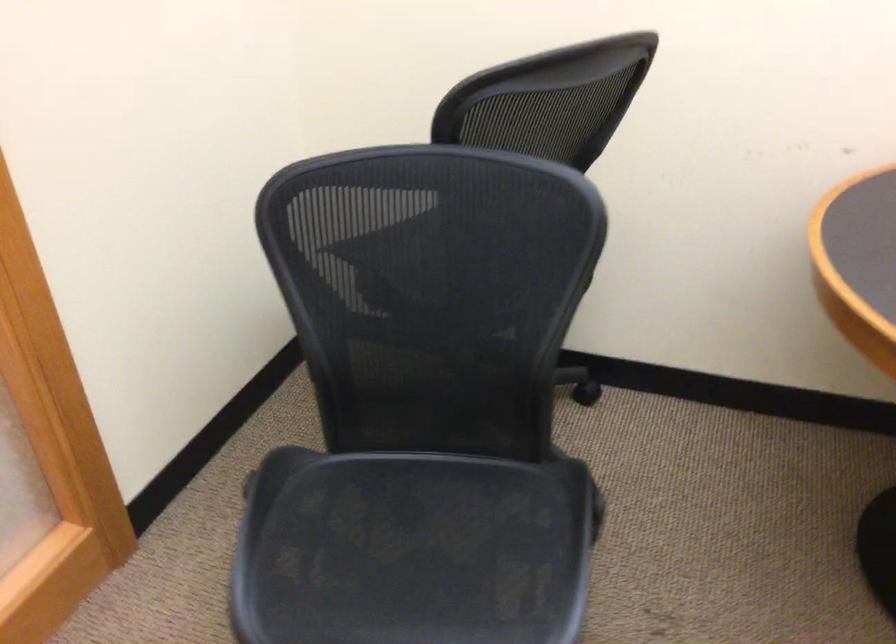
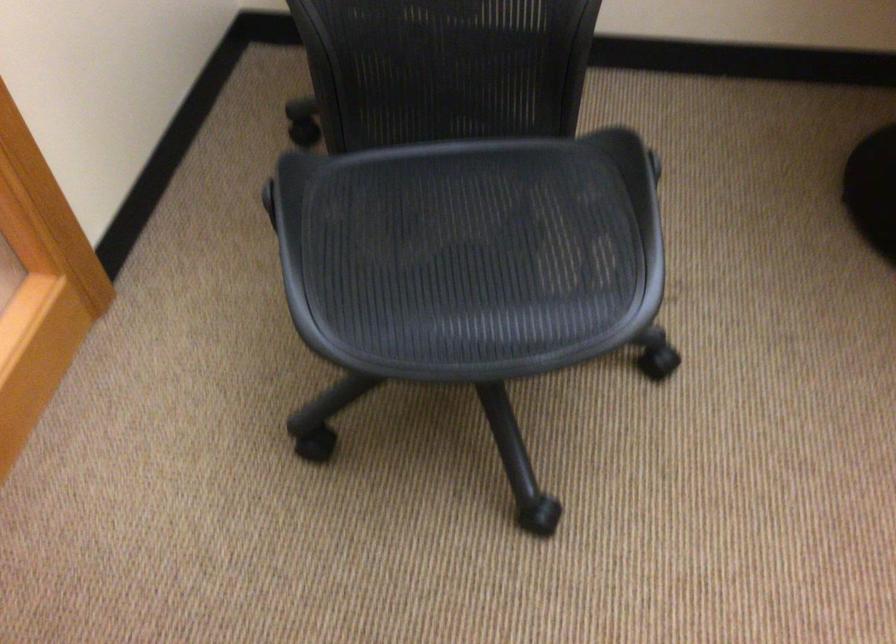
Find the pixel in the second image that matches pixel 409 567 in the first image.

(470, 254)